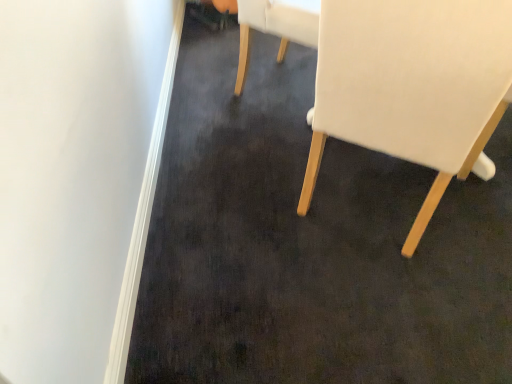
Describe the element at coordinates (412, 85) in the screenshot. This screenshot has width=512, height=384. I see `white fabric chair at right, placed as the 2th chair when sorted from back to front` at that location.

Where is `white fabric chair at right, which is counted as the first chair, starting from the front`? This screenshot has width=512, height=384. white fabric chair at right, which is counted as the first chair, starting from the front is located at coordinates (412, 85).

What is the approximate width of white fabric chair at right, which is counted as the first chair, starting from the front?

26.21 inches.

This screenshot has width=512, height=384. What do you see at coordinates (276, 27) in the screenshot? I see `white fabric chair at upper center, which ranks as the second chair in front-to-back order` at bounding box center [276, 27].

You are a GUI agent. You are given a task and a screenshot of the screen. Output one action in this format:
    pyautogui.click(x=<x>, y=<y>)
    Task: Click on the white fabric chair at upper center, which ranks as the second chair in front-to-back order
    
    Given the screenshot: What is the action you would take?
    pyautogui.click(x=276, y=27)

Find the location of a particular element. The width and height of the screenshot is (512, 384). white fabric chair at right, placed as the 2th chair when sorted from back to front is located at coordinates (412, 85).

Is white fabric chair at right, which is counted as the first chair, starting from the front, to the left of white fabric chair at upper center, which ranks as the second chair in front-to-back order, from the viewer's perspective?

No, white fabric chair at right, which is counted as the first chair, starting from the front, is not to the left of white fabric chair at upper center, which ranks as the second chair in front-to-back order.

In the image, is white fabric chair at right, which is counted as the first chair, starting from the front, positioned in front of or behind white fabric chair at upper center, arranged as the first chair when viewed from the back?

Visually, white fabric chair at right, which is counted as the first chair, starting from the front, is located in front of white fabric chair at upper center, arranged as the first chair when viewed from the back.

Considering the positions of points (500, 66) and (295, 23), is point (500, 66) closer to camera compared to point (295, 23)?

Yes, it is in front of point (295, 23).

From the image's perspective, is white fabric chair at right, which is counted as the first chair, starting from the front, on top of white fabric chair at upper center, arranged as the first chair when viewed from the back?

Incorrect, from the image's perspective, white fabric chair at right, which is counted as the first chair, starting from the front, is lower than white fabric chair at upper center, arranged as the first chair when viewed from the back.

From a real-world perspective, which is physically above, white fabric chair at right, which is counted as the first chair, starting from the front, or white fabric chair at upper center, arranged as the first chair when viewed from the back?

From a 3D spatial view, white fabric chair at right, which is counted as the first chair, starting from the front, is above.

Is white fabric chair at right, which is counted as the first chair, starting from the front, wider or thinner than white fabric chair at upper center, which ranks as the second chair in front-to-back order?

white fabric chair at right, which is counted as the first chair, starting from the front, is wider than white fabric chair at upper center, which ranks as the second chair in front-to-back order.

From the picture: From their relative heights in the image, would you say white fabric chair at right, placed as the 2th chair when sorted from back to front, is taller or shorter than white fabric chair at upper center, arranged as the first chair when viewed from the back?

Clearly, white fabric chair at right, placed as the 2th chair when sorted from back to front, is taller compared to white fabric chair at upper center, arranged as the first chair when viewed from the back.

Can you confirm if white fabric chair at right, which is counted as the first chair, starting from the front, is bigger than white fabric chair at upper center, arranged as the first chair when viewed from the back?

Yes, white fabric chair at right, which is counted as the first chair, starting from the front, is bigger than white fabric chair at upper center, arranged as the first chair when viewed from the back.

Could white fabric chair at upper center, arranged as the first chair when viewed from the back, be considered to be inside white fabric chair at right, placed as the 2th chair when sorted from back to front?

No, white fabric chair at upper center, arranged as the first chair when viewed from the back, is located outside of white fabric chair at right, placed as the 2th chair when sorted from back to front.

Would you consider white fabric chair at right, placed as the 2th chair when sorted from back to front, to be distant from white fabric chair at upper center, which ranks as the second chair in front-to-back order?

white fabric chair at right, placed as the 2th chair when sorted from back to front, is near white fabric chair at upper center, which ranks as the second chair in front-to-back order, not far away.

Consider the image. Is white fabric chair at right, which is counted as the first chair, starting from the front, aimed at white fabric chair at upper center, which ranks as the second chair in front-to-back order?

No, white fabric chair at right, which is counted as the first chair, starting from the front, is not aimed at white fabric chair at upper center, which ranks as the second chair in front-to-back order.

This screenshot has width=512, height=384. I want to click on chair that appears above the white fabric chair at upper center, which ranks as the second chair in front-to-back order (from a real-world perspective), so coord(412,85).

Is white fabric chair at upper center, arranged as the first chair when viewed from the back, at the right side of white fabric chair at right, placed as the 2th chair when sorted from back to front?

Answer: No, white fabric chair at upper center, arranged as the first chair when viewed from the back, is not to the right of white fabric chair at right, placed as the 2th chair when sorted from back to front.

Does white fabric chair at upper center, which ranks as the second chair in front-to-back order, lie in front of white fabric chair at right, placed as the 2th chair when sorted from back to front?

No, it is behind white fabric chair at right, placed as the 2th chair when sorted from back to front.

Which is behind, point (255, 4) or point (479, 1)?

The point (255, 4) is behind.

From the image's perspective, is white fabric chair at upper center, which ranks as the second chair in front-to-back order, under white fabric chair at right, placed as the 2th chair when sorted from back to front?

No, from the image's perspective, white fabric chair at upper center, which ranks as the second chair in front-to-back order, is not below white fabric chair at right, placed as the 2th chair when sorted from back to front.

From a real-world perspective, which is physically above, white fabric chair at upper center, which ranks as the second chair in front-to-back order, or white fabric chair at right, which is counted as the first chair, starting from the front?

In real-world perspective, white fabric chair at right, which is counted as the first chair, starting from the front, is above.

Looking at their sizes, would you say white fabric chair at upper center, which ranks as the second chair in front-to-back order, is wider or thinner than white fabric chair at right, which is counted as the first chair, starting from the front?

white fabric chair at upper center, which ranks as the second chair in front-to-back order, is thinner than white fabric chair at right, which is counted as the first chair, starting from the front.

Between white fabric chair at upper center, arranged as the first chair when viewed from the back, and white fabric chair at right, placed as the 2th chair when sorted from back to front, which one has less height?

white fabric chair at upper center, arranged as the first chair when viewed from the back, is shorter.

Consider the image. In terms of size, does white fabric chair at upper center, arranged as the first chair when viewed from the back, appear bigger or smaller than white fabric chair at right, which is counted as the first chair, starting from the front?

Clearly, white fabric chair at upper center, arranged as the first chair when viewed from the back, is smaller in size than white fabric chair at right, which is counted as the first chair, starting from the front.

Is white fabric chair at upper center, arranged as the first chair when viewed from the back, completely or partially outside of white fabric chair at right, which is counted as the first chair, starting from the front?

white fabric chair at upper center, arranged as the first chair when viewed from the back, lies outside white fabric chair at right, which is counted as the first chair, starting from the front,'s area.

Is white fabric chair at upper center, arranged as the first chair when viewed from the back, far away from white fabric chair at right, which is counted as the first chair, starting from the front?

That's not correct — white fabric chair at upper center, arranged as the first chair when viewed from the back, is a little close to white fabric chair at right, which is counted as the first chair, starting from the front.

Could you tell me if white fabric chair at upper center, which ranks as the second chair in front-to-back order, is facing white fabric chair at right, which is counted as the first chair, starting from the front?

Yes.

Looking at this image, could you measure the distance between white fabric chair at upper center, which ranks as the second chair in front-to-back order, and white fabric chair at right, which is counted as the first chair, starting from the front?

The distance of white fabric chair at upper center, which ranks as the second chair in front-to-back order, from white fabric chair at right, which is counted as the first chair, starting from the front, is 26.80 inches.

Where is `chair lying on the right of white fabric chair at upper center, arranged as the first chair when viewed from the back`? The image size is (512, 384). chair lying on the right of white fabric chair at upper center, arranged as the first chair when viewed from the back is located at coordinates (412, 85).

Image resolution: width=512 pixels, height=384 pixels. I want to click on chair that appears behind the white fabric chair at right, placed as the 2th chair when sorted from back to front, so pyautogui.click(x=276, y=27).

In order to click on chair located above the white fabric chair at right, which is counted as the first chair, starting from the front (from the image's perspective) in this screenshot , I will do `click(276, 27)`.